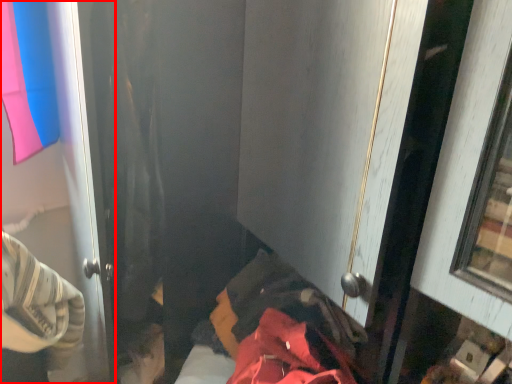
Question: From the image's perspective, considering the relative positions of door (annotated by the red box) and bed in the image provided, where is door (annotated by the red box) located with respect to the staircase?

Choices:
 (A) above
 (B) below

Answer: (A)